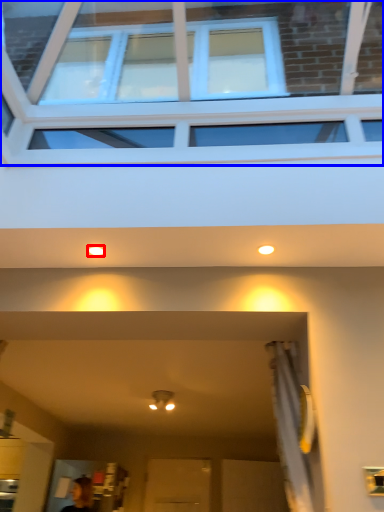
Question: Which object appears closest to the camera in this image, lighting (highlighted by a red box) or window (highlighted by a blue box)?

Choices:
 (A) lighting
 (B) window

Answer: (B)